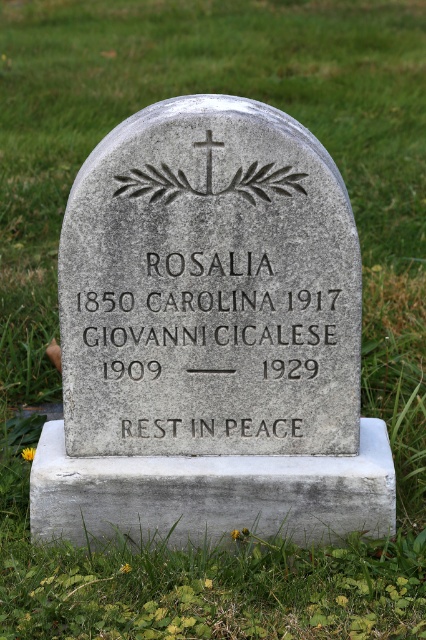
Locate an element on the screen. This screenshot has width=426, height=640. gray stone gravestone at center is located at coordinates (210, 339).

Which is behind, point (198, 195) or point (206, 192)?

Point (198, 195)

At what (x,y) coordinates should I click in order to perform the action: click on gray stone gravestone at center. Please return your answer as a coordinate pair (x, y). Looking at the image, I should click on (210, 339).